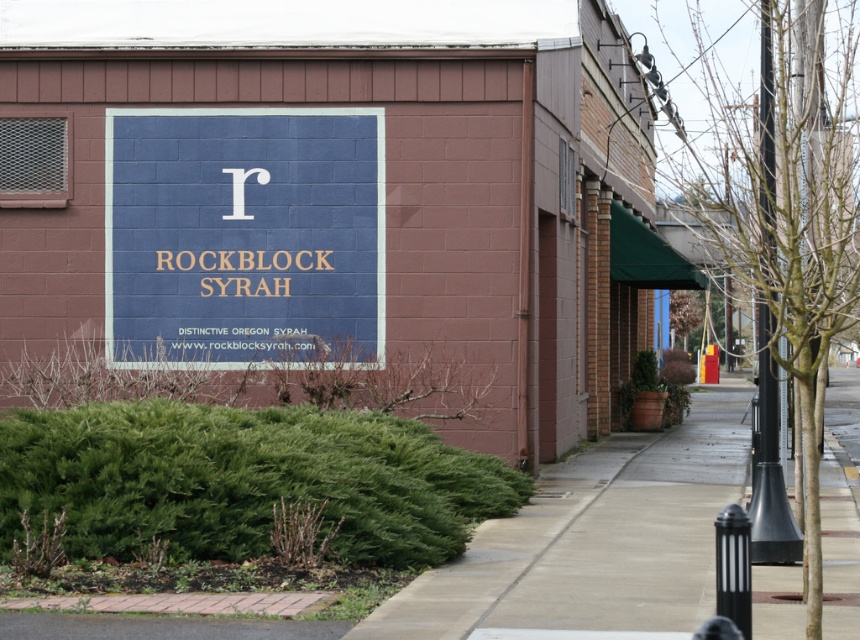
You are a delivery person who needs to park your 2.5 meter wide truck. You see the blue painted sign at center and the concrete sidewalk at center. Which area has enough space to park your truck?

The concrete sidewalk at center has enough space because it is larger than the blue painted sign at center, and the truck is 2.5 meters wide.

You are standing on the concrete sidewalk at center in front of the building. You want to look at the blue painted sign at center. Which direction should you look?

The blue painted sign at center is above the concrete sidewalk at center, so you should look upward to see it.